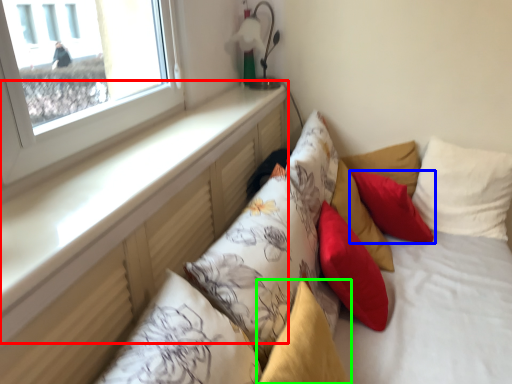
Question: Which object is the closest to the window sill (highlighted by a red box)? Choose among these: pillow (highlighted by a blue box) or pillow (highlighted by a green box).

Choices:
 (A) pillow
 (B) pillow

Answer: (B)